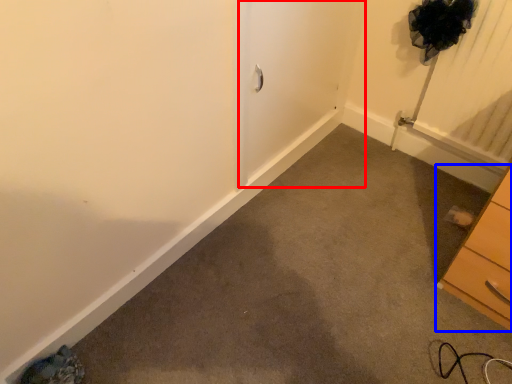
Question: Which object is further to the camera taking this photo, screen door (highlighted by a red box) or chest of drawers (highlighted by a blue box)?

Choices:
 (A) screen door
 (B) chest of drawers

Answer: (A)